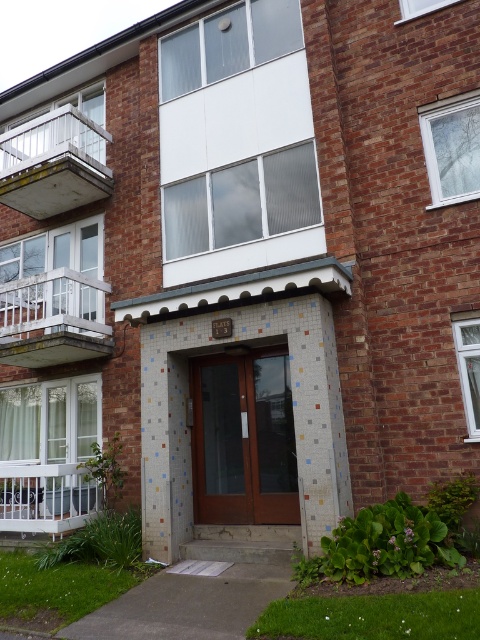
Measure the distance between point (51, 301) and camera.

Point (51, 301) and camera are 9.99 meters apart.

The image size is (480, 640). What do you see at coordinates (52, 317) in the screenshot? I see `white glass balcony at left` at bounding box center [52, 317].

The image size is (480, 640). I want to click on white glass balcony at left, so [x=52, y=317].

Is metallic glass balcony at left bigger than white glass balcony at left?

Correct, metallic glass balcony at left is larger in size than white glass balcony at left.

Who is more distant from viewer, (96, 173) or (83, 285)?

Point (83, 285)

Find the location of a particular element. The width and height of the screenshot is (480, 640). metallic glass balcony at left is located at coordinates (54, 163).

Does metallic glass balcony at left have a lesser height compared to white painted wood balcony at lower left?

Incorrect, metallic glass balcony at left's height does not fall short of white painted wood balcony at lower left's.

Between metallic glass balcony at left and white painted wood balcony at lower left, which one appears on the left side from the viewer's perspective?

metallic glass balcony at left

Which is behind, point (98, 144) or point (92, 493)?

Positioned behind is point (98, 144).

Where is `metallic glass balcony at left`? This screenshot has height=640, width=480. metallic glass balcony at left is located at coordinates (54, 163).